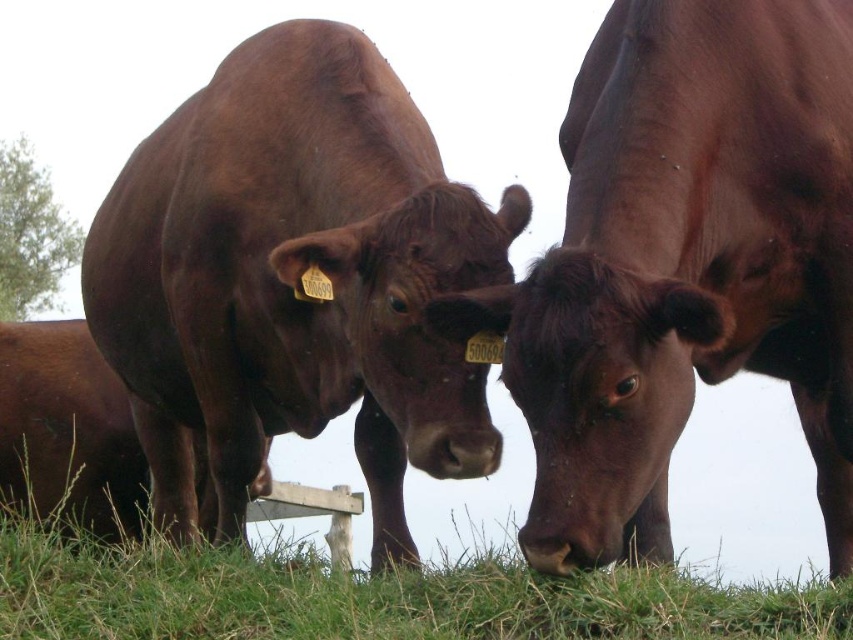
You are a farmer checking the location of your cows. You remember that the shiny brown bull at center has an ear tag with the number 50069. Where exactly is the point at coordinate (294,282) located on the shiny brown bull at center?

The point at coordinate (294,282) is located on the shiny brown bull at center, which has an ear tag with the number 50069.

You are a farmer checking the field. You see the green grass at lower center and the brown matte cow at center. Which one is wider?

The green grass at lower center might be wider than brown matte cow at center.